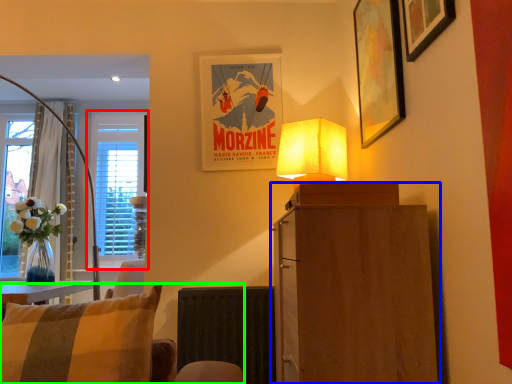
Question: Considering the real-world distances, which object is farthest from window (highlighted by a red box)? cabinetry (highlighted by a blue box) or chair (highlighted by a green box)?

Choices:
 (A) cabinetry
 (B) chair

Answer: (A)